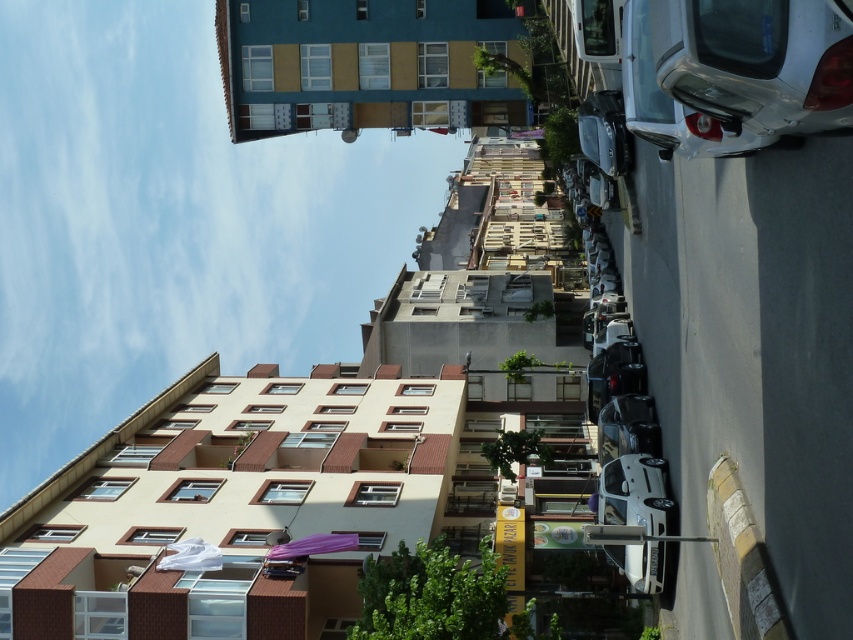
Is white glossy car at right positioned behind shiny silver car at center?

No, it is in front of shiny silver car at center.

Between white glossy car at right and shiny silver car at center, which one is positioned higher?

white glossy car at right

Is point (677, 81) positioned behind point (614, 426)?

No, (677, 81) is closer to viewer.

Identify the location of white glossy car at right. (733, 72).

Can you confirm if white glossy car at right is positioned to the right of shiny black car at center?

Incorrect, white glossy car at right is not on the right side of shiny black car at center.

Does white glossy car at right have a lesser height compared to shiny black car at center?

No, white glossy car at right is not shorter than shiny black car at center.

The height and width of the screenshot is (640, 853). Find the location of `white glossy car at right`. white glossy car at right is located at coordinates (733, 72).

Can you confirm if white glossy car at center is smaller than shiny black car at center?

Correct, white glossy car at center occupies less space than shiny black car at center.

Between point (633, 572) and point (645, 392), which one is positioned in front?

Point (633, 572) is in front.

Find the location of a particular element. Image resolution: width=853 pixels, height=640 pixels. white glossy car at center is located at coordinates (637, 493).